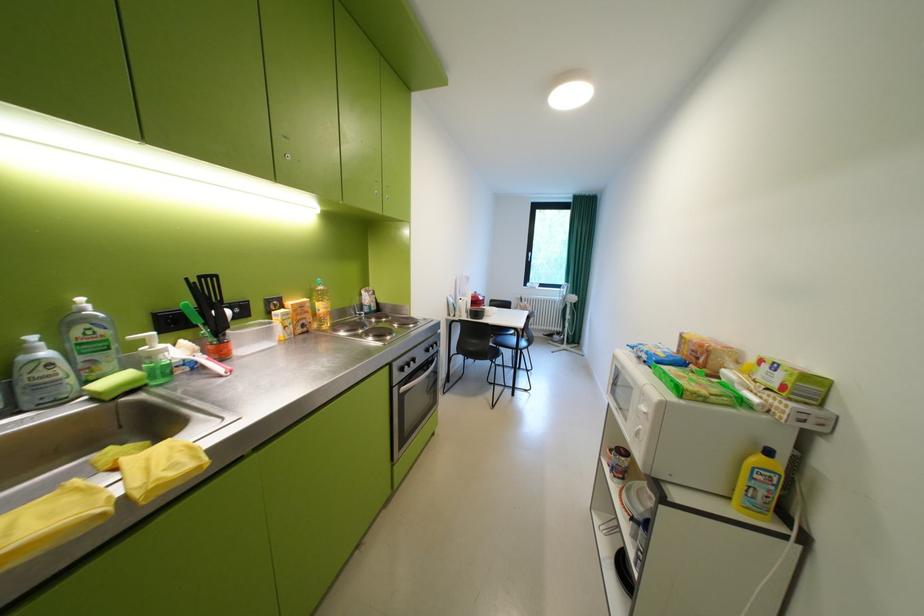
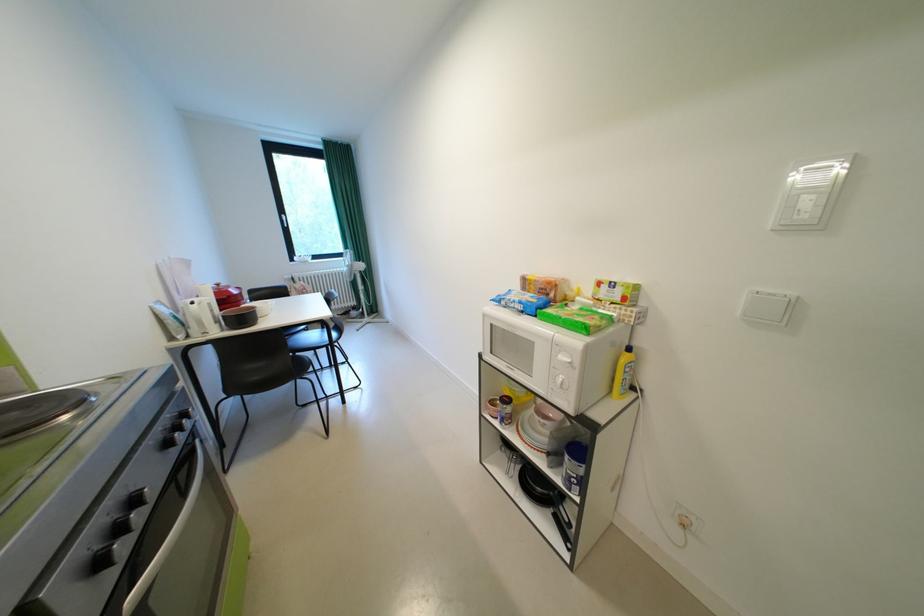
The point at [438,351] is marked in the first image. Where is the corresponding point in the second image?

(176, 446)